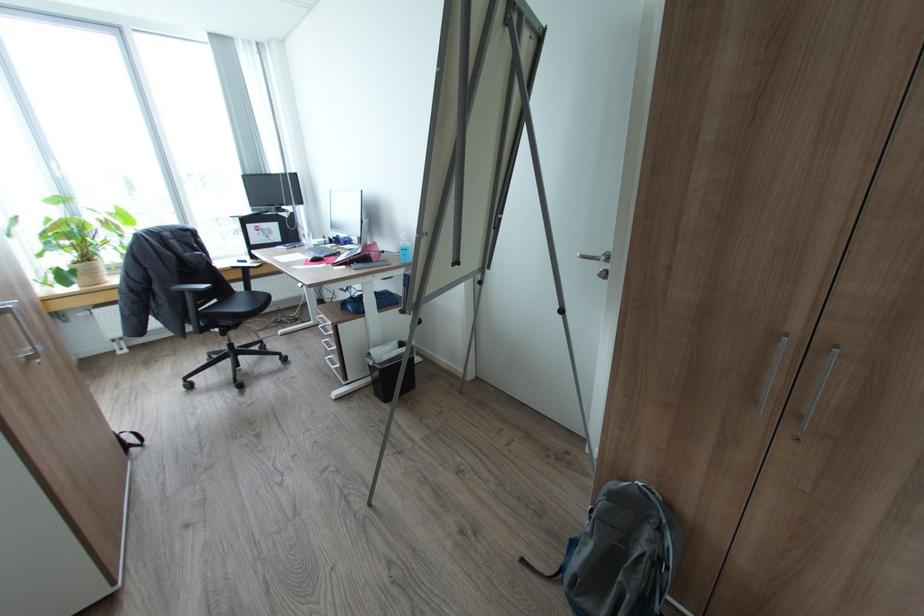
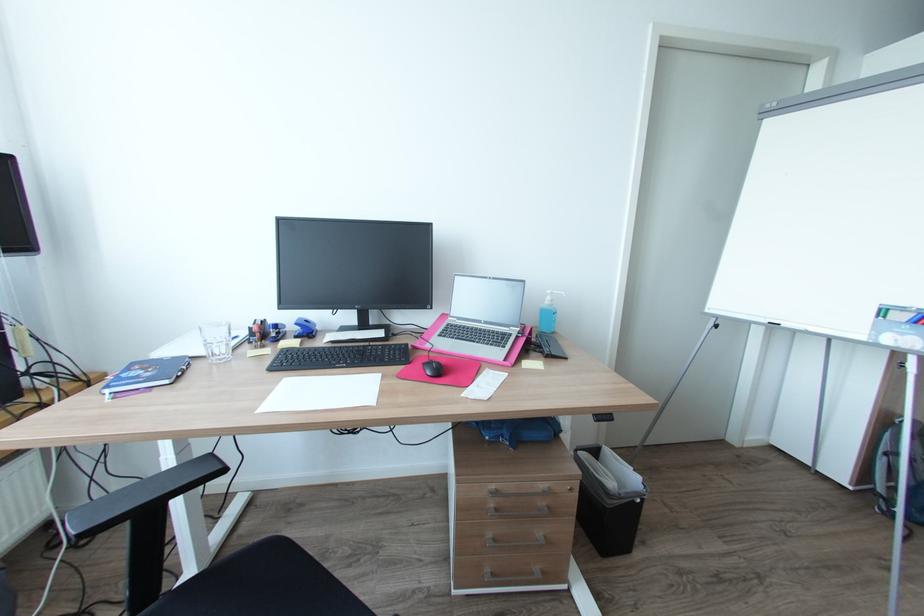
In the second image, find the point that corresponds to the point at 290,246 in the first image.

(171, 381)